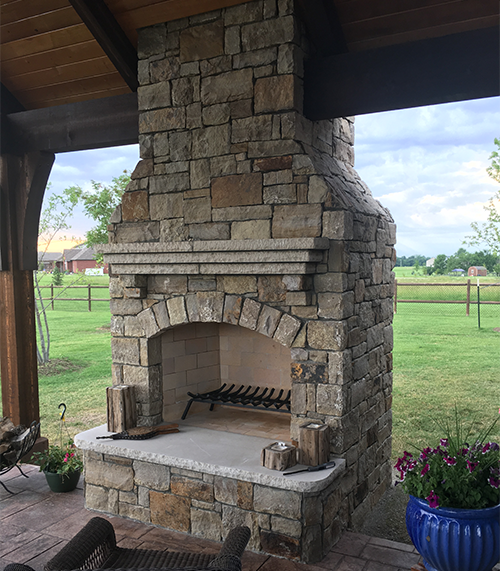
Find the location of a particular element. The height and width of the screenshot is (571, 500). wooden roof is located at coordinates (55, 58).